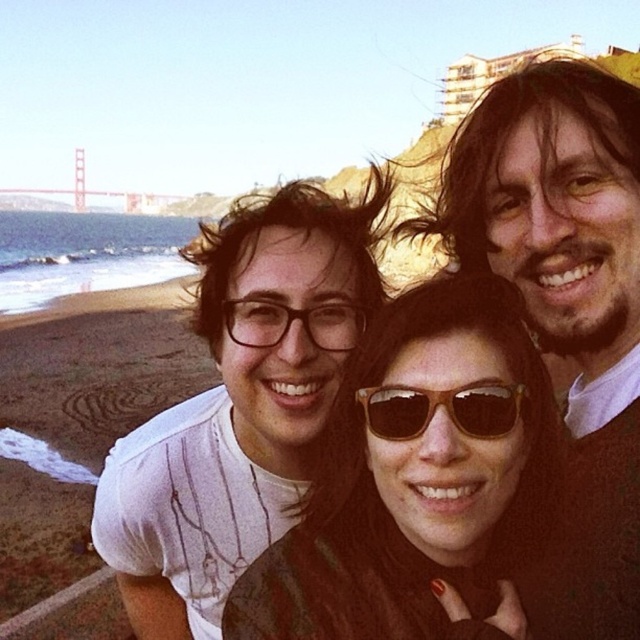
Measure the distance between matte black hair at upper right and brown wooden sunglasses at center.

matte black hair at upper right is 6.05 meters from brown wooden sunglasses at center.

Which is more to the left, matte black hair at upper right or brown wooden sunglasses at center?

Positioned to the left is brown wooden sunglasses at center.

Measure the distance between matte black hair at upper right and camera.

56.80 feet

Locate an element on the screen. matte black hair at upper right is located at coordinates (566, 305).

In the scene shown: Between brown leather jacket at center and matte black hair at upper right, which one has less height?

Standing shorter between the two is brown leather jacket at center.

Does brown leather jacket at center appear over matte black hair at upper right?

No, brown leather jacket at center is not above matte black hair at upper right.

You are a GUI agent. You are given a task and a screenshot of the screen. Output one action in this format:
    pyautogui.click(x=<x>, y=<y>)
    Task: Click on the brown leather jacket at center
    Image resolution: width=640 pixels, height=640 pixels.
    Given the screenshot: What is the action you would take?
    pyautogui.click(x=417, y=477)

From the picture: Which is more to the right, white matte t-shirt at center or metallic bridge at upper left?

white matte t-shirt at center is more to the right.

Image resolution: width=640 pixels, height=640 pixels. What are the coordinates of `white matte t-shirt at center` in the screenshot? It's located at (240, 406).

Identify the location of white matte t-shirt at center. (240, 406).